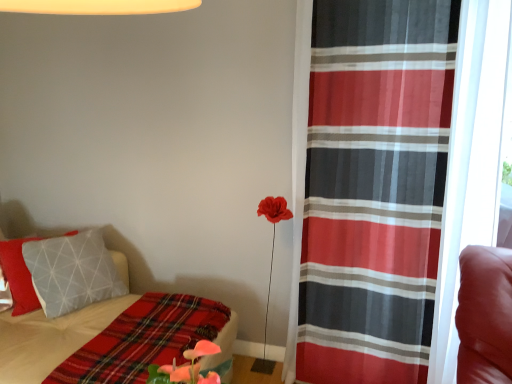
Question: From the image's perspective, relative to plaid fabric blanket at lower left, is plaid fabric bed at lower left above or below?

Choices:
 (A) above
 (B) below

Answer: (A)

Question: Is plaid fabric bed at lower left taller or shorter than plaid fabric blanket at lower left?

Choices:
 (A) tall
 (B) short

Answer: (A)

Question: Which is nearer to the plaid fabric blanket at lower left?

Choices:
 (A) plaid fabric bed at lower left
 (B) red sheer curtain at right

Answer: (A)

Question: Which object is positioned farthest from the red sheer curtain at right?

Choices:
 (A) plaid fabric blanket at lower left
 (B) plaid fabric bed at lower left

Answer: (B)